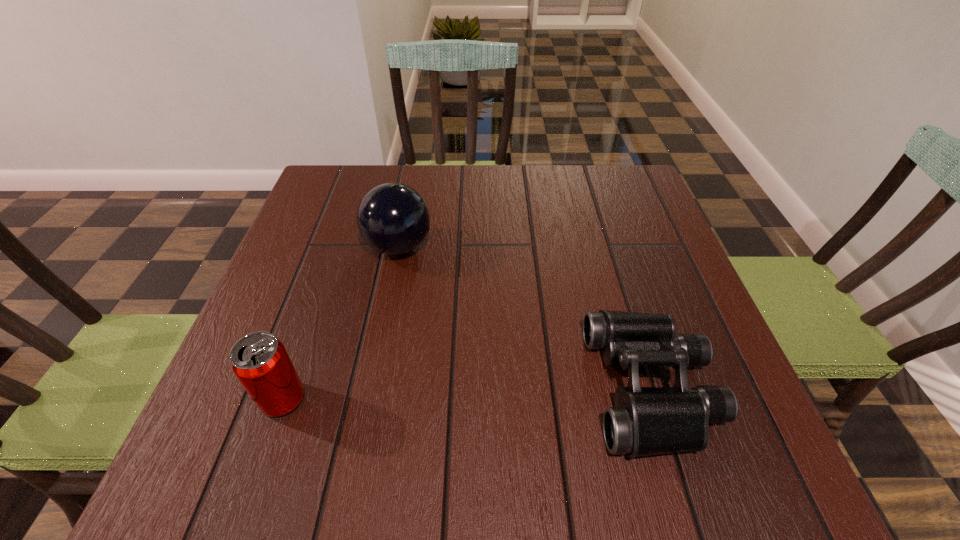
Locate an element on the screen. This screenshot has height=540, width=960. free space that is in between the soda can and the farthest object is located at coordinates (341, 323).

Choose which object is the second nearest neighbor to the leftmost object. Please provide its 2D coordinates. Your answer should be formatted as a tuple, i.e. [(x, y)], where the tuple contains the x and y coordinates of a point satisfying the conditions above.

[(645, 421)]

Select which object is the second closest to the rightmost object. Please provide its 2D coordinates. Your answer should be formatted as a tuple, i.e. [(x, y)], where the tuple contains the x and y coordinates of a point satisfying the conditions above.

[(259, 360)]

This screenshot has height=540, width=960. Identify the location of vacant space that satisfies the following two spatial constraints: 1. on the side of the second object from right to left with the finger holes; 2. on the front side of the leftmost object. (369, 400).